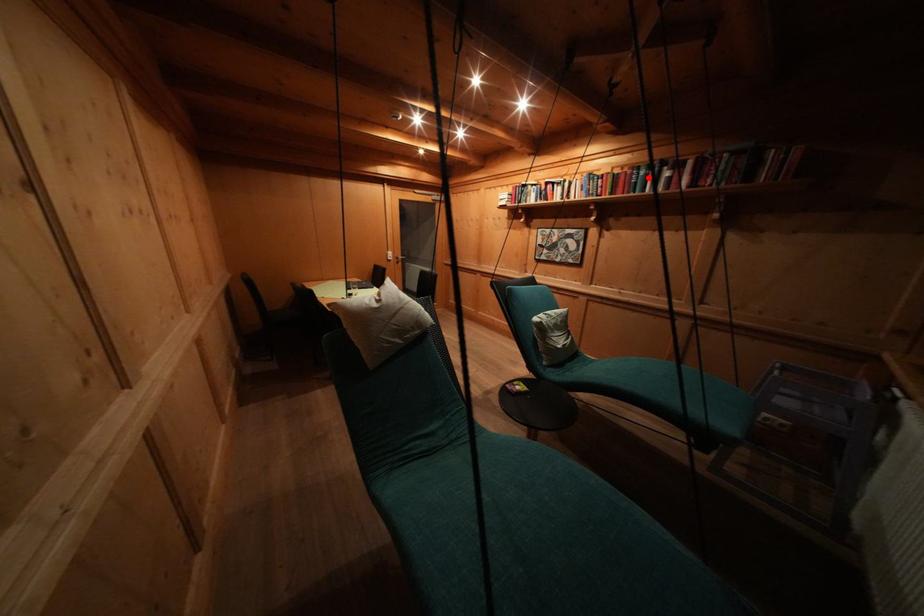
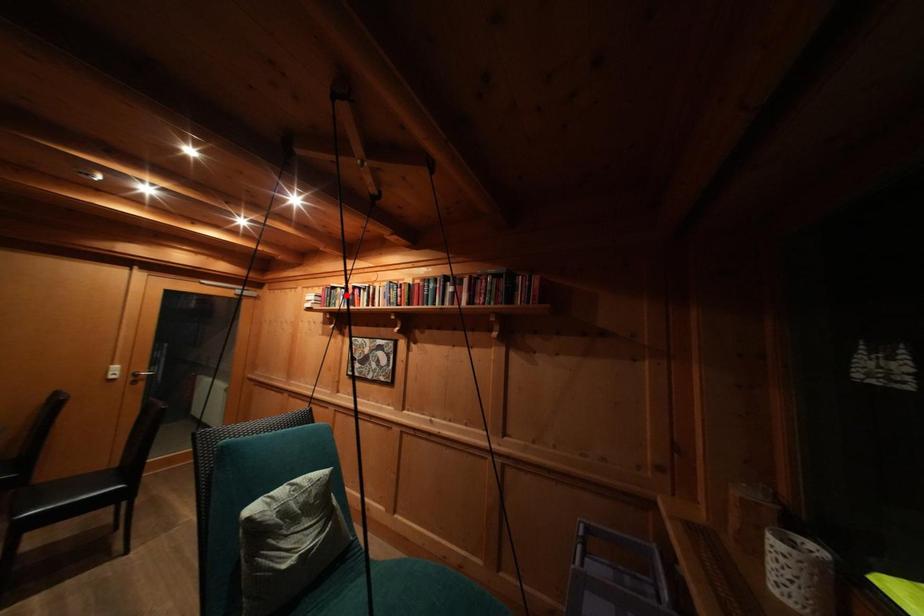
I am providing you with two images of the same scene from different viewpoints. A red point is marked on the first image and another point is marked on the second image. Are the points marked in image1 and image2 representing the same 3D position?

No